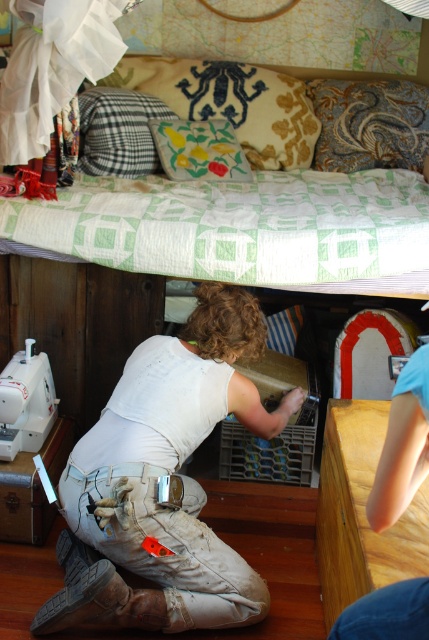
You are trying to arrange two pillows on a bed. The yellow fabric pillow at upper center and the floral fabric cushion at upper center need to be spaced exactly 10 inches apart. Based on the scene description, will the current spacing meet the requirement?

The yellow fabric pillow at upper center is 10.17 inches from the floral fabric cushion at upper center, which is slightly more than the required 10 inches. The current spacing meets the requirement as it is within an acceptable margin of error.

You are a person trying to find a yellow fabric pillow at upper center in a room with a bed. The bed has a green and white quilt and several pillows. According to the coordinates given, where would you look first?

The yellow fabric pillow at upper center is located at point (232, 104), so you should look near that coordinate first.